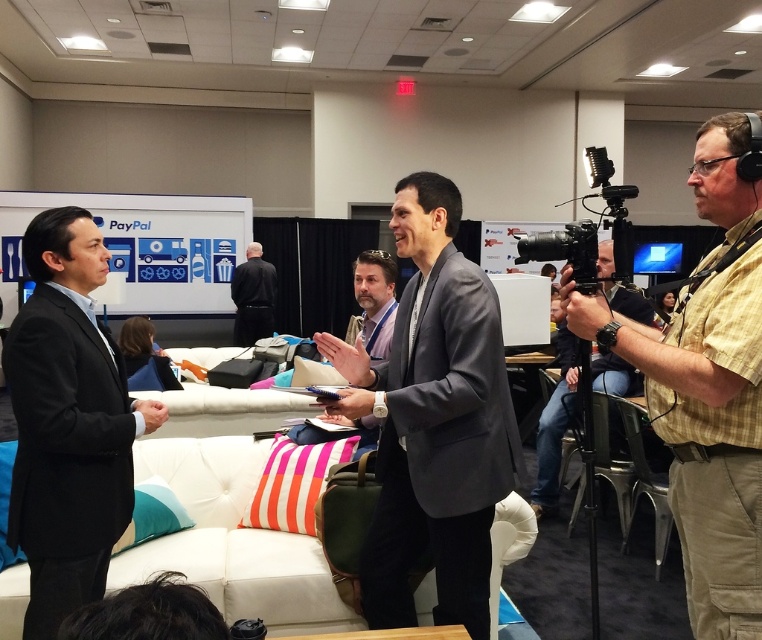
What do you see at coordinates (434, 420) in the screenshot? I see `gray fabric suit at center` at bounding box center [434, 420].

Which is below, gray fabric suit at center or black suit at left?

gray fabric suit at center

You are a GUI agent. You are given a task and a screenshot of the screen. Output one action in this format:
    pyautogui.click(x=<x>, y=<y>)
    Task: Click on the gray fabric suit at center
    Image resolution: width=762 pixels, height=640 pixels.
    Given the screenshot: What is the action you would take?
    pyautogui.click(x=434, y=420)

Can you confirm if yellow plaid shirt at right is shorter than gray suit at center?

In fact, yellow plaid shirt at right may be taller than gray suit at center.

Does yellow plaid shirt at right appear over gray suit at center?

Incorrect, yellow plaid shirt at right is not positioned above gray suit at center.

Who is more distant from viewer, (744, 227) or (341, 365)?

Positioned behind is point (341, 365).

Image resolution: width=762 pixels, height=640 pixels. I want to click on yellow plaid shirt at right, so click(706, 384).

Between gray fabric suit at center and yellow plaid shirt at right, which one has less height?

yellow plaid shirt at right is shorter.

Is gray fabric suit at center thinner than yellow plaid shirt at right?

In fact, gray fabric suit at center might be wider than yellow plaid shirt at right.

What are the coordinates of `gray fabric suit at center` in the screenshot? It's located at (434, 420).

Identify the location of gray fabric suit at center. (434, 420).